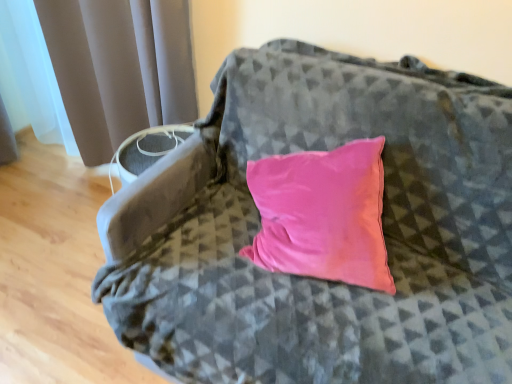
Question: Should I look upward or downward to see satin gray curtain at left?

Choices:
 (A) down
 (B) up

Answer: (B)

Question: From the image's perspective, would you say satin gray curtain at left is positioned over velvet pink pillow at center?

Choices:
 (A) no
 (B) yes

Answer: (B)

Question: Considering the relative positions of satin gray curtain at left and velvet pink pillow at center in the image provided, is satin gray curtain at left in front of velvet pink pillow at center?

Choices:
 (A) no
 (B) yes

Answer: (A)

Question: Does satin gray curtain at left have a larger size compared to velvet pink pillow at center?

Choices:
 (A) no
 (B) yes

Answer: (B)

Question: Is satin gray curtain at left positioned behind velvet pink pillow at center?

Choices:
 (A) yes
 (B) no

Answer: (A)

Question: From the image's perspective, is satin gray curtain at left beneath velvet pink pillow at center?

Choices:
 (A) yes
 (B) no

Answer: (B)

Question: Can you confirm if satin gray curtain at left is positioned to the left of velvet pink pillow at center?

Choices:
 (A) no
 (B) yes

Answer: (B)

Question: Is velvet pink pillow at center positioned with its back to satin gray curtain at left?

Choices:
 (A) yes
 (B) no

Answer: (B)

Question: From a real-world perspective, does velvet pink pillow at center stand above satin gray curtain at left?

Choices:
 (A) no
 (B) yes

Answer: (B)

Question: Is velvet pink pillow at center positioned behind satin gray curtain at left?

Choices:
 (A) no
 (B) yes

Answer: (A)

Question: Is there a large distance between velvet pink pillow at center and satin gray curtain at left?

Choices:
 (A) no
 (B) yes

Answer: (A)

Question: Would you say velvet pink pillow at center contains satin gray curtain at left?

Choices:
 (A) no
 (B) yes

Answer: (A)

Question: Is velvet pink pillow at center positioned beyond the bounds of satin gray curtain at left?

Choices:
 (A) yes
 (B) no

Answer: (A)

Question: From a real-world perspective, is velvet pink pillow at center positioned above or below satin gray curtain at left?

Choices:
 (A) below
 (B) above

Answer: (B)